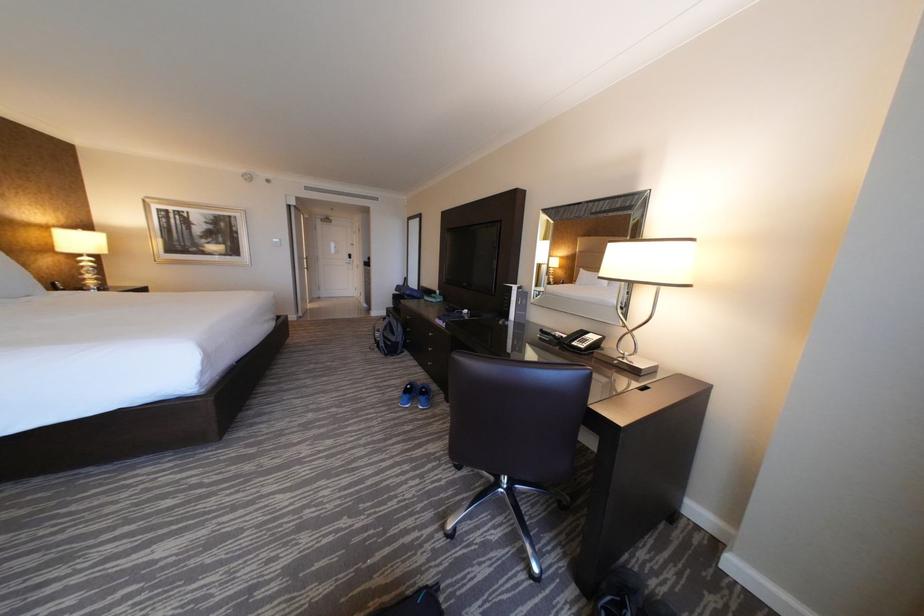
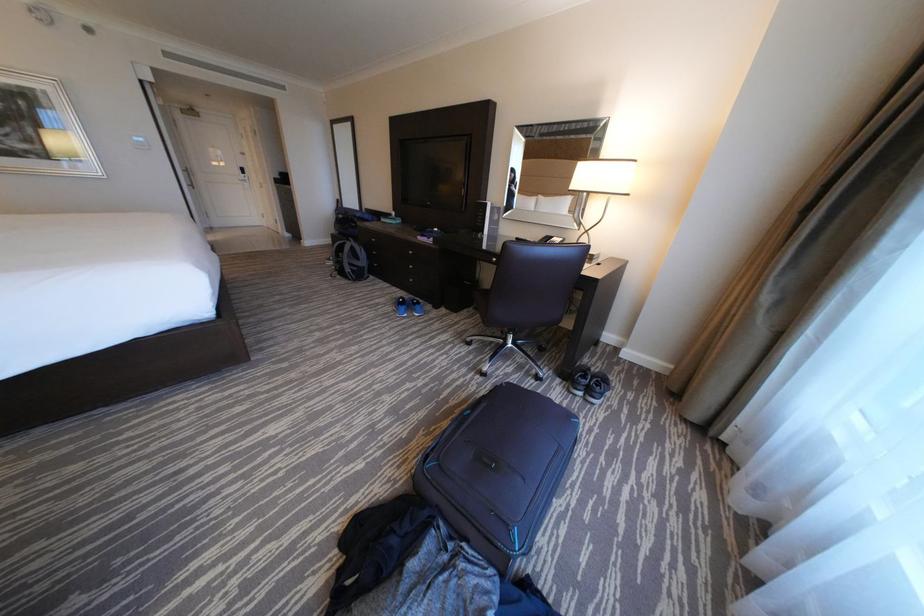
The first image is from the beginning of the video and the second image is from the end. How did the camera likely rotate when shooting the video?

The camera rotated toward right-down.